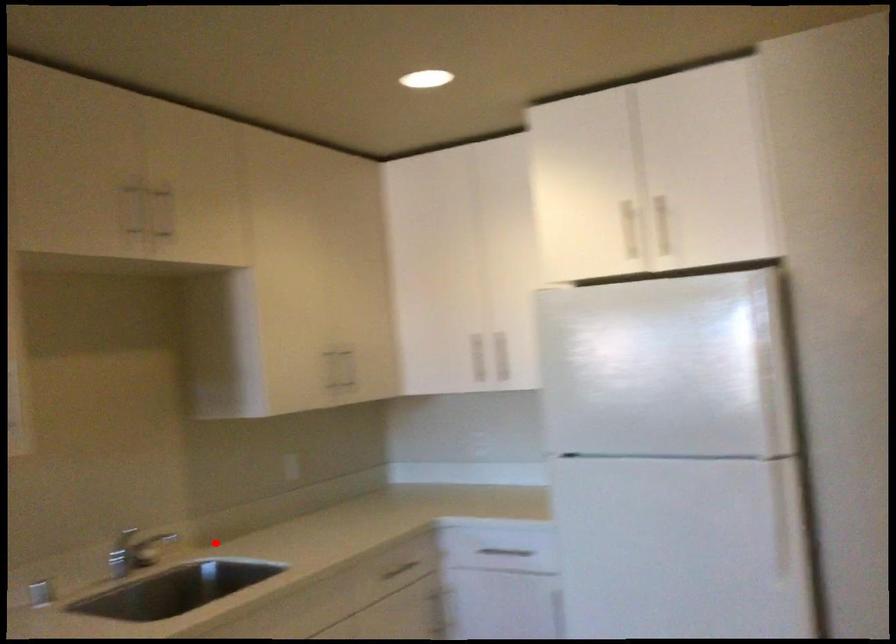
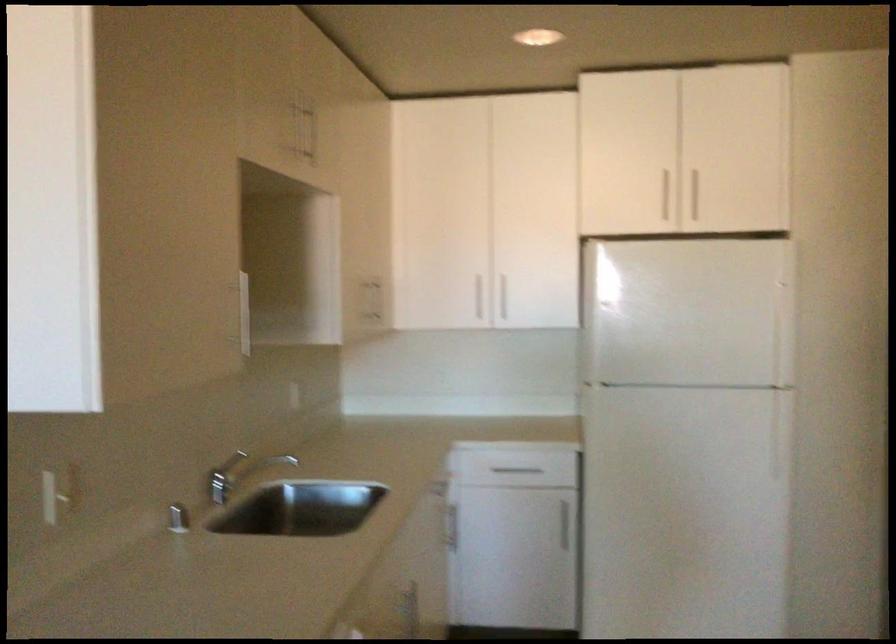
Where in the second image is the point corresponding to the highlighted location from the first image?

(263, 467)